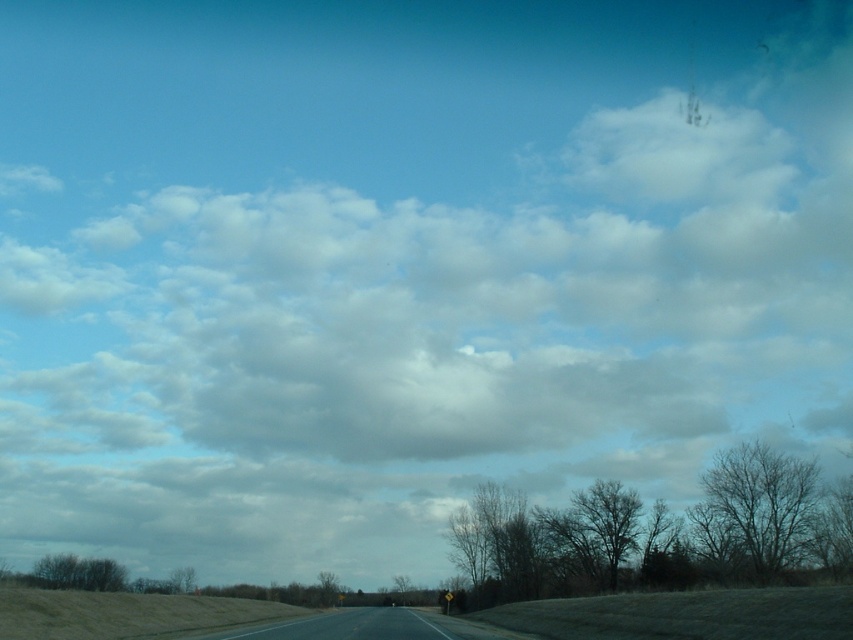
You are a drone operator trying to map the location of objects in the scene. The coordinate system starts at the bottom left corner of the image with x increasing to the right and y increasing upwards. What are the coordinates of the dark brown textured tree at center?

The coordinates of the dark brown textured tree at center are at point (496, 545).

You are a painter planning to sketch this scene. You want to ensure that the bare branches at right and the dark brown textured tree at center are proportionally accurate. Which object should you make smaller in your sketch?

The bare branches at right should be made smaller in the sketch because they occupy less space than the dark brown textured tree at center according to the description.